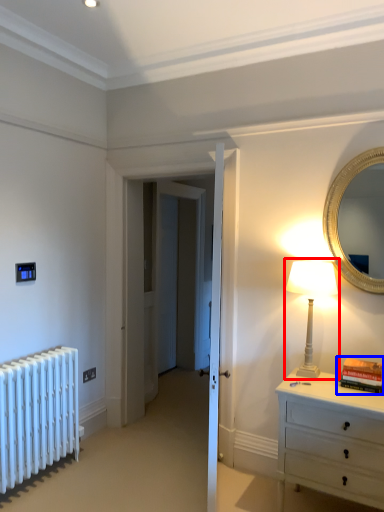
Question: Which of the following is the closest to the observer, table lamp (highlighted by a red box) or book (highlighted by a blue box)?

Choices:
 (A) table lamp
 (B) book

Answer: (B)